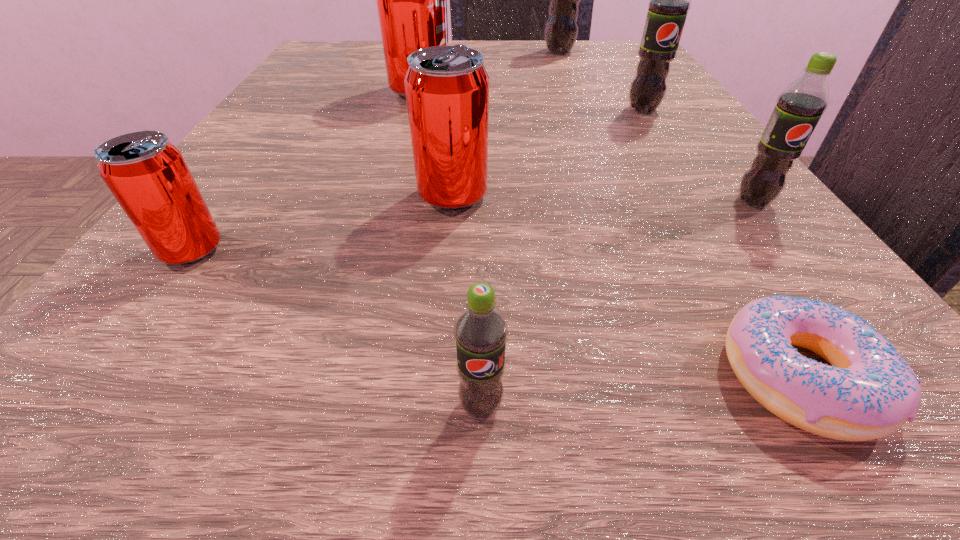
In the image, there is a desktop. Where is `vacant area at the far left corner`? vacant area at the far left corner is located at coordinates (359, 42).

Where is `vacant space at the far right corner of the desktop`? The height and width of the screenshot is (540, 960). vacant space at the far right corner of the desktop is located at coordinates pyautogui.click(x=592, y=46).

This screenshot has width=960, height=540. Find the location of `unoccupied position between the nearest soda and the second nearest green soda`. unoccupied position between the nearest soda and the second nearest green soda is located at coordinates (617, 303).

Locate an element on the screen. vacant area between the third biggest green soda and the smallest green soda is located at coordinates (617, 303).

Where is `free space between the rightmost soda and the second nearest red soda can`? The image size is (960, 540). free space between the rightmost soda and the second nearest red soda can is located at coordinates (603, 199).

This screenshot has height=540, width=960. Identify the location of free point between the tallest soda and the second nearest soda. (375, 151).

This screenshot has height=540, width=960. I want to click on vacant space that is in between the nearest green soda and the third farthest green soda, so click(x=617, y=303).

At what (x,y) coordinates should I click in order to perform the action: click on blank region between the leftmost red soda can and the second biggest red soda can. Please return your answer as a coordinate pair (x, y). Looking at the image, I should click on (323, 222).

Where is `free space between the third green soda from left to right and the tallest soda`? Image resolution: width=960 pixels, height=540 pixels. free space between the third green soda from left to right and the tallest soda is located at coordinates (601, 81).

Where is `vacant region between the biggest red soda can and the second biggest green soda`? vacant region between the biggest red soda can and the second biggest green soda is located at coordinates (532, 100).